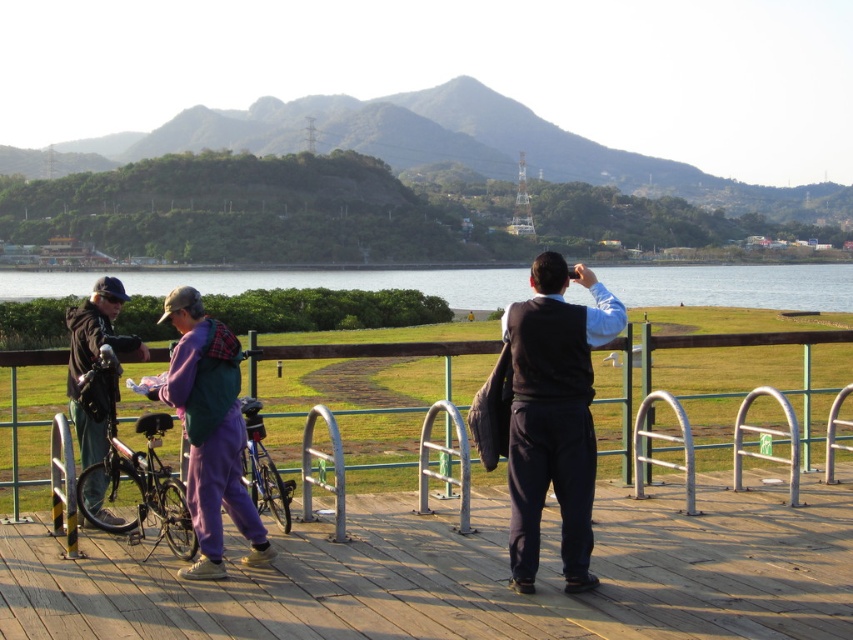
Is green metal fence at center taller than shiny metallic bicycle at left?

Yes.

Which is above, green metal fence at center or shiny metallic bicycle at left?

green metal fence at center is higher up.

At what (x,y) coordinates should I click in order to perform the action: click on green metal fence at center. Please return your answer as a coordinate pair (x, y). The width and height of the screenshot is (853, 640). Looking at the image, I should click on (363, 349).

Is point (643, 300) more distant than point (70, 314)?

Yes, point (643, 300) is farther from viewer.

Between point (199, 284) and point (105, 289), which one is positioned behind?

Point (199, 284)

Identify the location of clear water at center. The width and height of the screenshot is (853, 640). (734, 285).

Based on the photo, between purple fleece jacket at lower left and blue metallic bicycle at center, which one appears on the left side from the viewer's perspective?

Positioned to the left is purple fleece jacket at lower left.

Is purple fleece jacket at lower left to the left of blue metallic bicycle at center from the viewer's perspective?

Yes, purple fleece jacket at lower left is to the left of blue metallic bicycle at center.

Between point (215, 564) and point (247, 448), which one is positioned behind?

Point (247, 448)

In order to click on purple fleece jacket at lower left in this screenshot , I will do `click(209, 432)`.